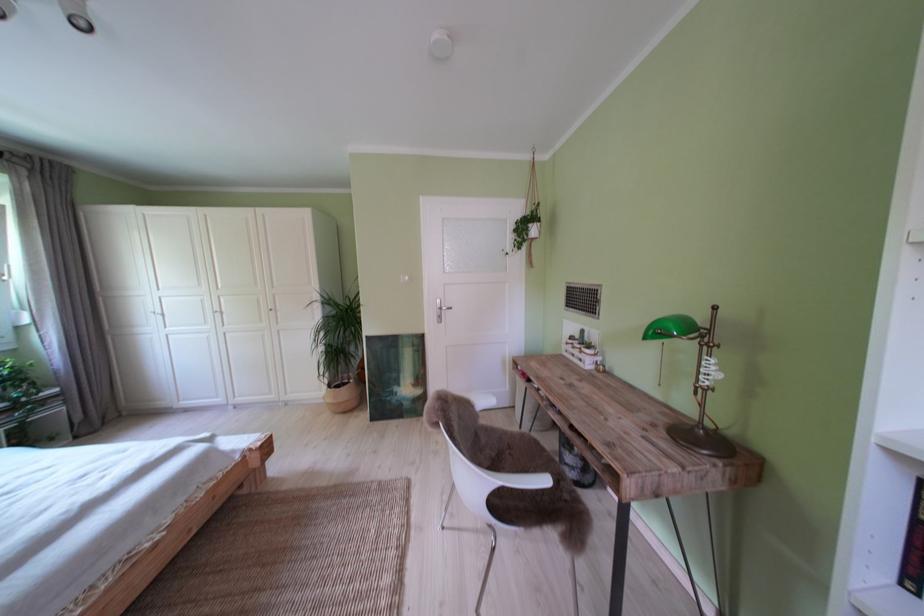
What do you see at coordinates (440, 310) in the screenshot?
I see `the silver door handle` at bounding box center [440, 310].